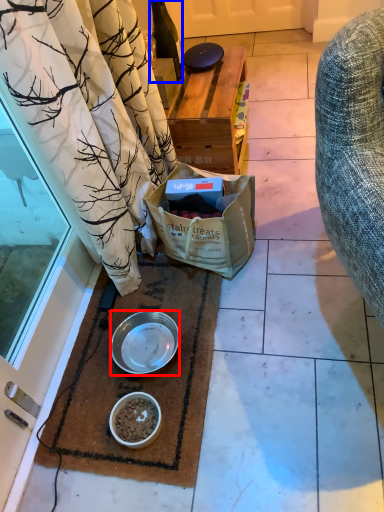
Question: Which of the following is the closest to the observer, bowl (highlighted by a red box) or bottle (highlighted by a blue box)?

Choices:
 (A) bowl
 (B) bottle

Answer: (A)